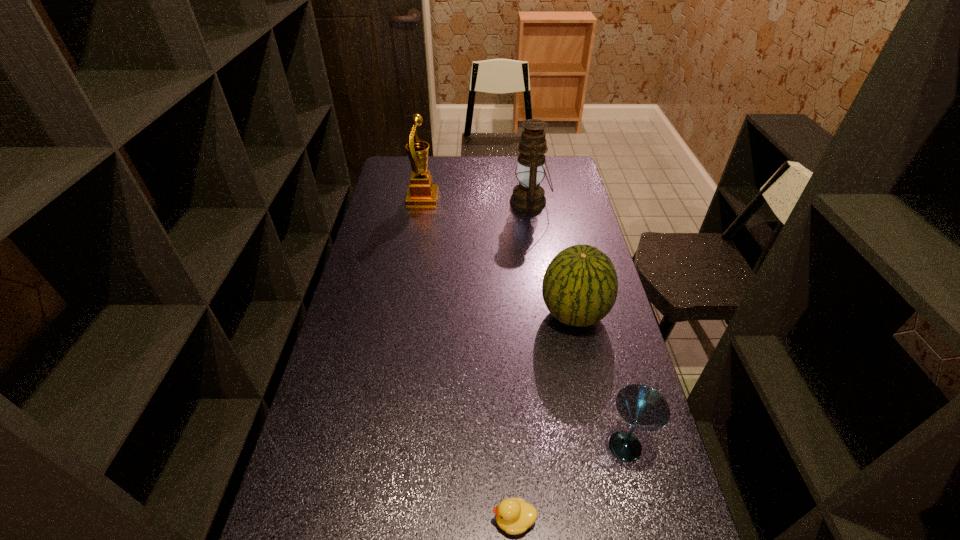
In the image, there is a desktop. Where is `vacant space at the left edge`? This screenshot has height=540, width=960. vacant space at the left edge is located at coordinates (328, 495).

Identify the location of vacant space at the right edge of the desktop. The width and height of the screenshot is (960, 540). (601, 333).

Identify the location of vacant area that lies between the leftmost object and the nearest object. Image resolution: width=960 pixels, height=540 pixels. (468, 359).

The height and width of the screenshot is (540, 960). Identify the location of empty space that is in between the third shortest object and the oil lamp. (552, 258).

Locate an element on the screen. Image resolution: width=960 pixels, height=540 pixels. empty location between the shortest object and the oil lamp is located at coordinates point(522,361).

I want to click on free space between the award and the watermelon, so click(x=498, y=256).

At what (x,y) coordinates should I click in order to perform the action: click on free point between the watermelon and the oil lamp. Please return your answer as a coordinate pair (x, y). This screenshot has width=960, height=540. Looking at the image, I should click on 552,258.

Locate an element on the screen. blank region between the third tallest object and the award is located at coordinates (498, 256).

This screenshot has width=960, height=540. I want to click on unoccupied position between the second object from left to right and the second shortest object, so click(x=569, y=483).

The image size is (960, 540). Identify the location of free space that is in between the oil lamp and the shortest object. (522, 361).